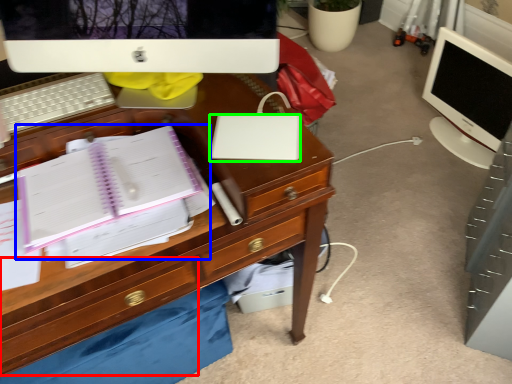
Question: Which object is the closest to the drawer (highlighted by a red box)? Choose among these: notebook (highlighted by a blue box) or laptop (highlighted by a green box).

Choices:
 (A) notebook
 (B) laptop

Answer: (A)